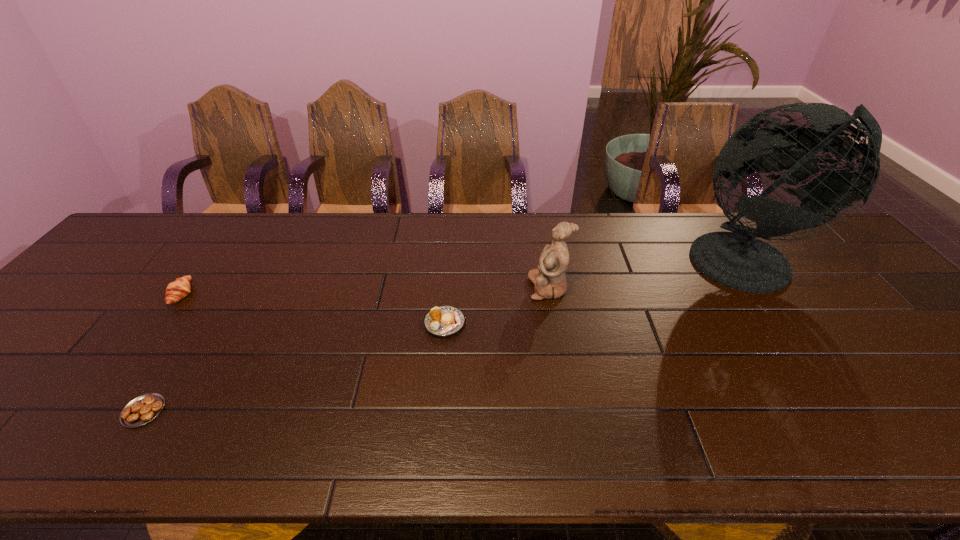
Where is `object that is at the far right corner`? The image size is (960, 540). object that is at the far right corner is located at coordinates (737, 260).

What are the coordinates of `vacant point at the far edge` in the screenshot? It's located at (500, 247).

Locate an element on the screen. Image resolution: width=960 pixels, height=540 pixels. free space at the near edge is located at coordinates (327, 461).

You are a GUI agent. You are given a task and a screenshot of the screen. Output one action in this format:
    pyautogui.click(x=<x>, y=<y>)
    Task: Click on the vacant area at the right edge of the desktop
    The width and height of the screenshot is (960, 540).
    Given the screenshot: What is the action you would take?
    pyautogui.click(x=820, y=272)

At what (x,y) coordinates should I click in order to perform the action: click on vacant space at the far left corner. Please return your answer as a coordinate pair (x, y). The width and height of the screenshot is (960, 540). Looking at the image, I should click on (144, 240).

Where is `vacant space in between the tallest object and the leftmost pastry`? The width and height of the screenshot is (960, 540). vacant space in between the tallest object and the leftmost pastry is located at coordinates (467, 278).

The width and height of the screenshot is (960, 540). I want to click on free space that is in between the shortest pastry and the rightmost object, so click(447, 336).

Where is `free space that is in between the second shortest pastry and the rightmost object`? This screenshot has width=960, height=540. free space that is in between the second shortest pastry and the rightmost object is located at coordinates (598, 293).

Find the location of a particular element. Image resolution: width=960 pixels, height=540 pixels. blank region between the shortest pastry and the second tallest pastry is located at coordinates (294, 367).

Identify the location of free space between the leftmost object and the rightmost object. The height and width of the screenshot is (540, 960). (467, 278).